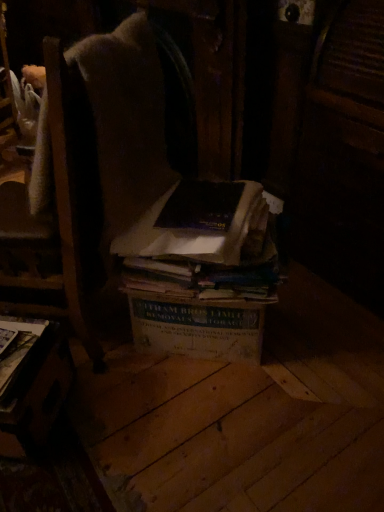
Where is `empty space that is to the right of wooden table at lower left`? The image size is (384, 512). empty space that is to the right of wooden table at lower left is located at coordinates (96, 432).